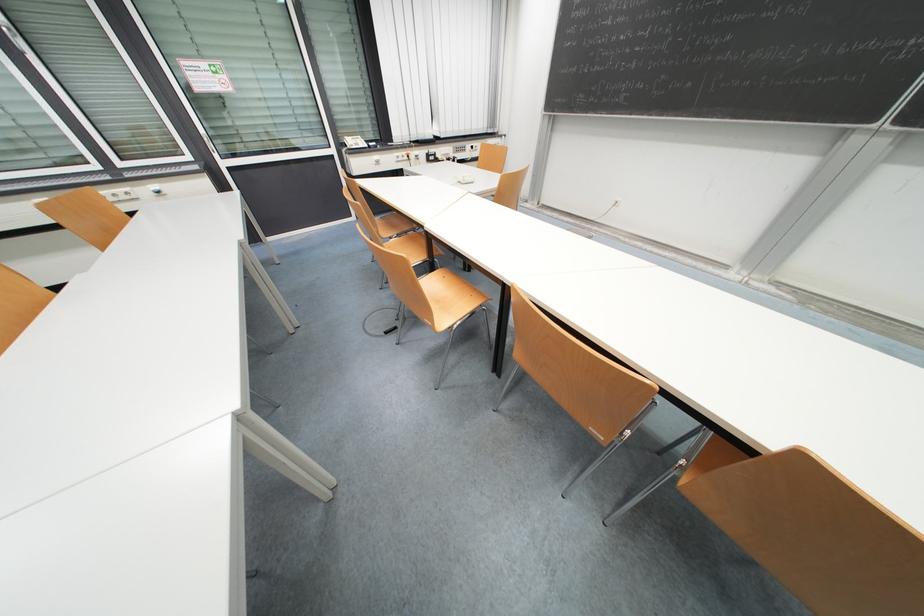
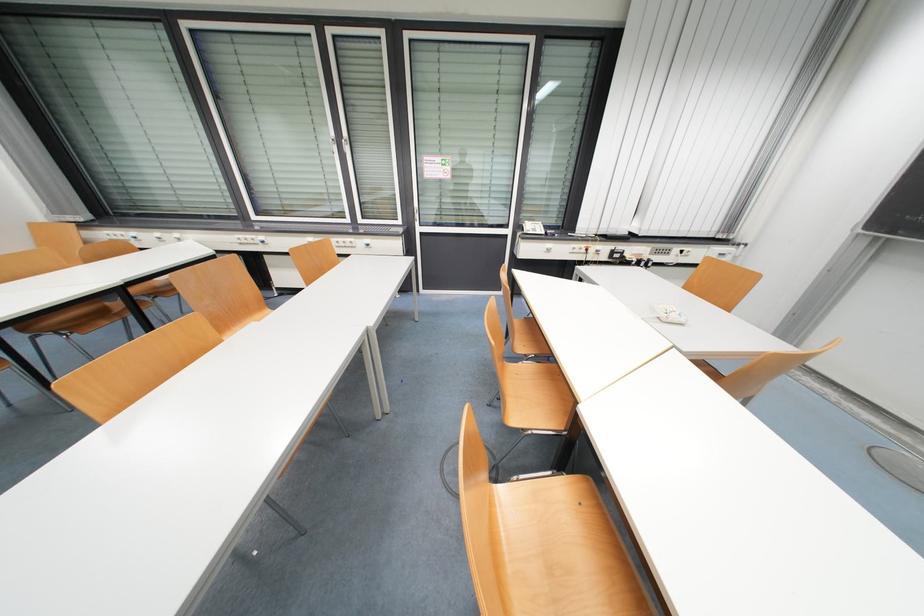
The point at (409, 155) is marked in the first image. Where is the corresponding point in the second image?

(589, 246)